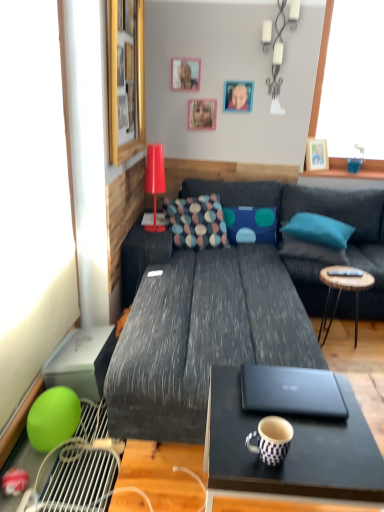
Locate an element on the screen. This screenshot has width=384, height=512. vacant space that is to the left of blue and white checkered coffee cup at lower center is located at coordinates (228, 450).